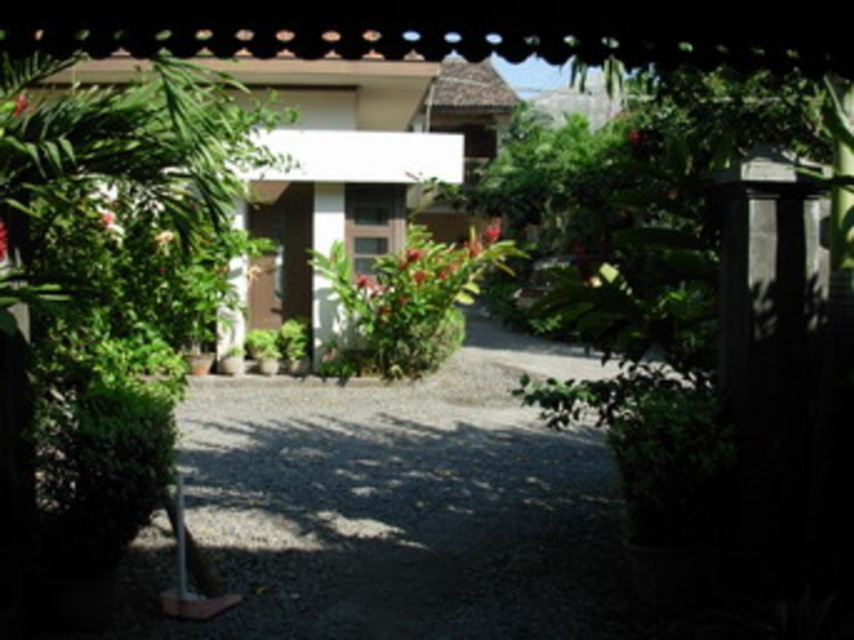
Question: Does green leafy plant at left appear over green leafy bush at center?

Choices:
 (A) no
 (B) yes

Answer: (B)

Question: Does green leafy plant at left appear on the right side of green leafy bush at center?

Choices:
 (A) no
 (B) yes

Answer: (A)

Question: Which of the following is the farthest from the observer?

Choices:
 (A) green leafy bush at center
 (B) green leafy plant at left

Answer: (A)

Question: Which point is closer to the camera?

Choices:
 (A) green leafy plant at left
 (B) green leafy bush at center

Answer: (A)

Question: Can you confirm if green leafy plant at left is positioned below green leafy bush at center?

Choices:
 (A) no
 (B) yes

Answer: (A)